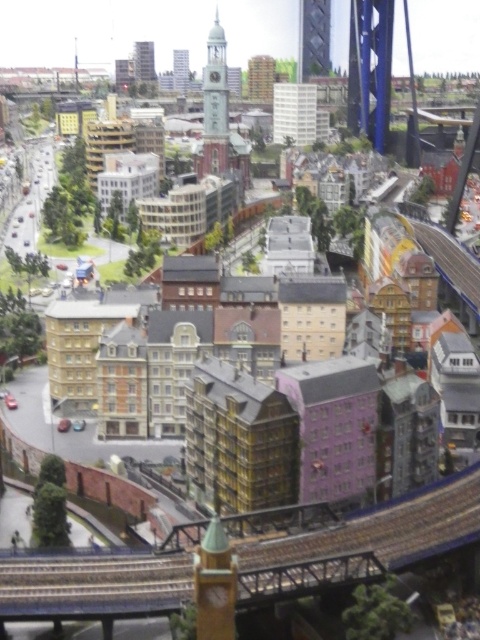
Question: Estimate the real-world distances between objects in this image. Which object is farther from the metallic silver tower at upper center?

Choices:
 (A) shiny glass tower at upper center
 (B) gold metallic clock tower at center
 (C) smooth white clock tower at upper center

Answer: (B)

Question: Among these objects, which one is farthest from the camera?

Choices:
 (A) shiny glass tower at upper center
 (B) metallic silver tower at upper center

Answer: (B)

Question: Is gold metallic clock tower at center above shiny glass tower at upper center?

Choices:
 (A) no
 (B) yes

Answer: (A)

Question: From the image, what is the correct spatial relationship of shiny glass tower at upper center in relation to smooth white clock tower at upper center?

Choices:
 (A) below
 (B) above

Answer: (B)

Question: Which object is farther from the camera taking this photo?

Choices:
 (A) shiny glass tower at upper center
 (B) gold metallic clock tower at center
 (C) metallic silver tower at upper center

Answer: (C)

Question: Is gold metallic clock tower at center smaller than smooth white clock tower at upper center?

Choices:
 (A) yes
 (B) no

Answer: (B)